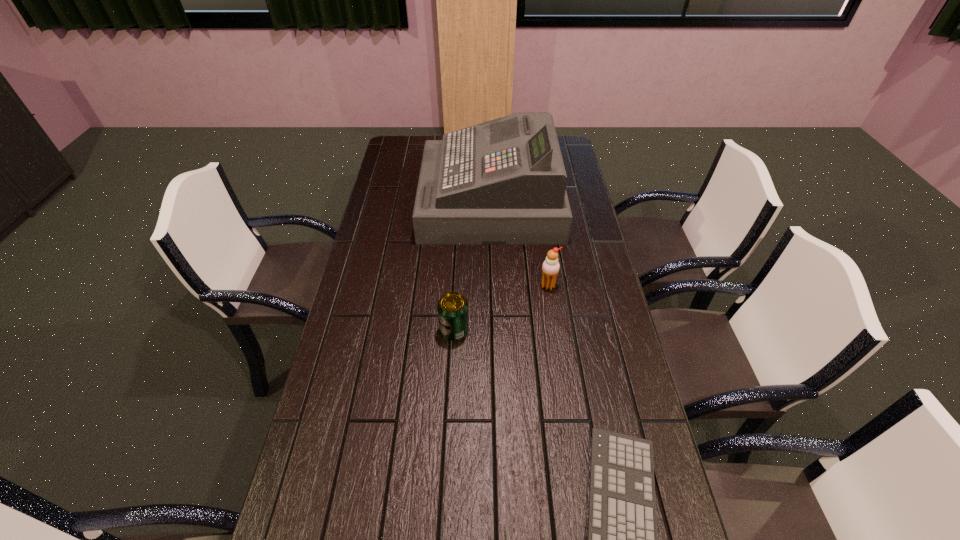
Where is `cash register`? The height and width of the screenshot is (540, 960). cash register is located at coordinates (503, 182).

The image size is (960, 540). In order to click on the tallest object in this screenshot , I will do `click(503, 182)`.

Image resolution: width=960 pixels, height=540 pixels. Find the location of `the third shortest object`. the third shortest object is located at coordinates (550, 268).

The height and width of the screenshot is (540, 960). I want to click on the third nearest object, so click(550, 268).

This screenshot has width=960, height=540. What are the coordinates of `the third farthest object` in the screenshot? It's located at (452, 307).

Find the location of `beer can`. beer can is located at coordinates (452, 307).

Where is `vacant space positioned on the front-facing side of the cash register`? vacant space positioned on the front-facing side of the cash register is located at coordinates (399, 201).

I want to click on vacant space located 0.110m on the front-facing side of the cash register, so click(x=395, y=201).

You are a GUI agent. You are given a task and a screenshot of the screen. Output one action in this format:
    pyautogui.click(x=<x>, y=<y>)
    Task: Click on the free region located 0.270m at the front with a straw on the third shortest object
    
    Given the screenshot: What is the action you would take?
    pyautogui.click(x=560, y=363)

Identify the location of free region located 0.230m on the right of the beer can. The height and width of the screenshot is (540, 960). (546, 330).